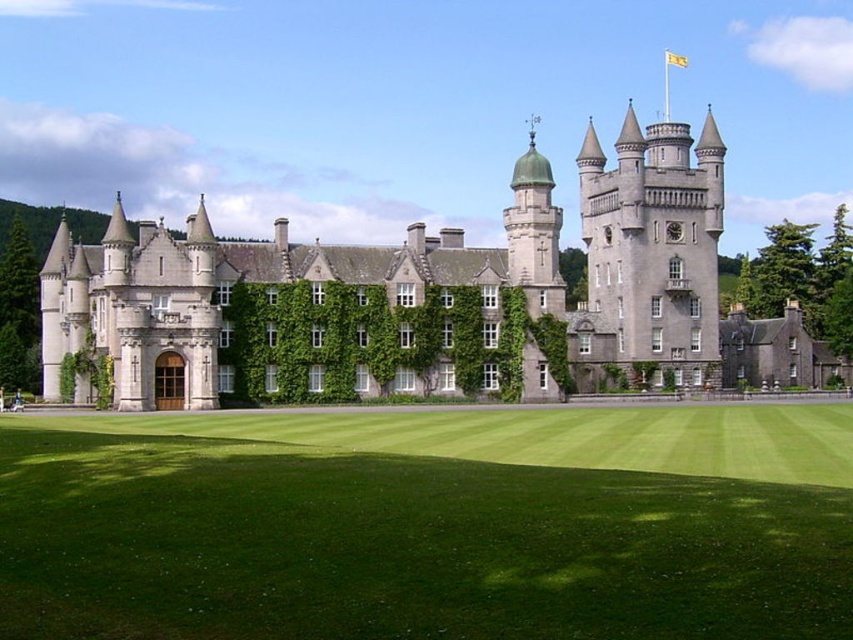
Between green grass at center and green grass at lower center, which one has less height?

green grass at lower center

Which of these two, green grass at center or green grass at lower center, stands taller?

green grass at center is taller.

Is point (682, 496) farther from viewer compared to point (751, 410)?

No, (682, 496) is in front of (751, 410).

Locate an element on the screen. green grass at center is located at coordinates (431, 525).

Measure the distance between green grass at center and green ivy at center.

green grass at center and green ivy at center are 23.16 meters apart from each other.

Between green grass at center and green ivy at center, which one appears on the right side from the viewer's perspective?

green grass at center is more to the right.

Is point (711, 573) less distant than point (460, 387)?

Yes.

Where is `green grass at center`? This screenshot has height=640, width=853. green grass at center is located at coordinates (431, 525).

Who is higher up, green grass at lower center or green ivy at center?

green ivy at center is higher up.

Is green grass at lower center closer to camera compared to green ivy at center?

Yes, it is in front of green ivy at center.

Between point (398, 444) and point (231, 387), which one is positioned in front?

Point (398, 444) is in front.

Identify the location of green grass at lower center. [537, 436].